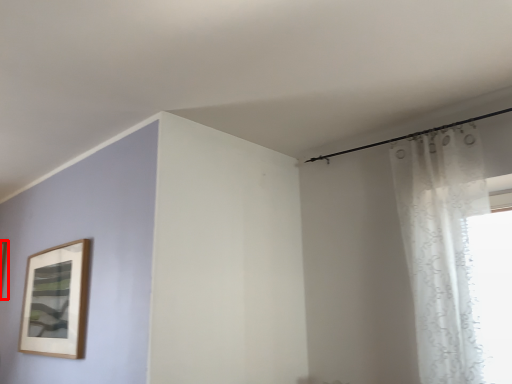
Question: From the image's perspective, where is picture frame (annotated by the red box) located relative to curtain?

Choices:
 (A) above
 (B) below

Answer: (B)